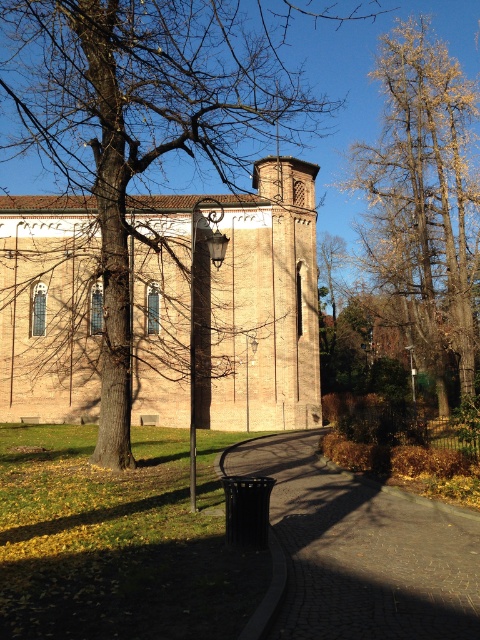
Question: Estimate the real-world distances between objects in this image. Which object is closer to the brick church at center?

Choices:
 (A) brown textured tree at center
 (B) golden-brown bark tree at upper right
 (C) brown cobblestone path at lower center

Answer: (A)

Question: Among these points, which one is nearest to the camera?

Choices:
 (A) (383, 147)
 (B) (168, 285)
 (C) (84, 17)

Answer: (C)

Question: Is brown textured tree at center wider than golden-brown bark tree at upper right?

Choices:
 (A) no
 (B) yes

Answer: (B)

Question: Based on their relative distances, which object is nearer to the golden-brown bark tree at upper right?

Choices:
 (A) brick church at center
 (B) brown cobblestone path at lower center
 (C) brown textured tree at center

Answer: (A)

Question: Does brown cobblestone path at lower center have a lesser width compared to golden-brown bark tree at upper right?

Choices:
 (A) no
 (B) yes

Answer: (B)

Question: Does brown textured tree at center have a lesser width compared to golden-brown bark tree at upper right?

Choices:
 (A) no
 (B) yes

Answer: (A)